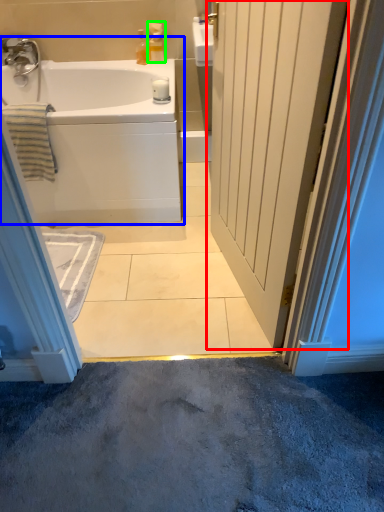
Question: Which object is positioned closest to door (highlighted by a red box)? Select from bathtub (highlighted by a blue box) and toiletry (highlighted by a green box).

Choices:
 (A) bathtub
 (B) toiletry

Answer: (A)